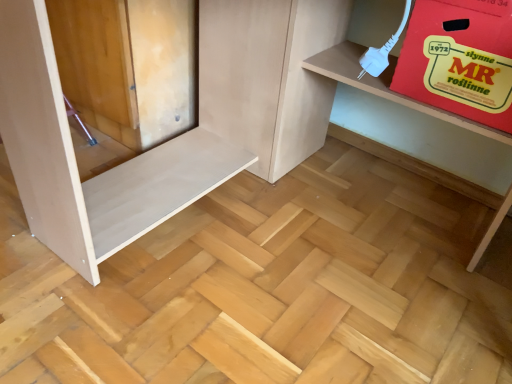
Question: Can you confirm if matte cardboard box at upper right is wider than red cardboard box at upper right?

Choices:
 (A) no
 (B) yes

Answer: (B)

Question: From the image's perspective, is matte cardboard box at upper right beneath red cardboard box at upper right?

Choices:
 (A) no
 (B) yes

Answer: (B)

Question: Does matte cardboard box at upper right have a smaller size compared to red cardboard box at upper right?

Choices:
 (A) yes
 (B) no

Answer: (B)

Question: Is matte cardboard box at upper right bigger than red cardboard box at upper right?

Choices:
 (A) yes
 (B) no

Answer: (A)

Question: Is matte cardboard box at upper right shorter than red cardboard box at upper right?

Choices:
 (A) no
 (B) yes

Answer: (A)

Question: Is matte cardboard box at upper right positioned in front of red cardboard box at upper right?

Choices:
 (A) yes
 (B) no

Answer: (A)

Question: From the image's perspective, would you say red cardboard box at upper right is shown under matte cardboard box at upper right?

Choices:
 (A) no
 (B) yes

Answer: (A)

Question: From the image's perspective, is red cardboard box at upper right over matte cardboard box at upper right?

Choices:
 (A) no
 (B) yes

Answer: (B)

Question: Is matte cardboard box at upper right completely or partially inside red cardboard box at upper right?

Choices:
 (A) no
 (B) yes

Answer: (A)

Question: Does red cardboard box at upper right turn towards matte cardboard box at upper right?

Choices:
 (A) yes
 (B) no

Answer: (A)

Question: Does red cardboard box at upper right appear on the left side of matte cardboard box at upper right?

Choices:
 (A) yes
 (B) no

Answer: (B)

Question: Are red cardboard box at upper right and matte cardboard box at upper right far apart?

Choices:
 (A) yes
 (B) no

Answer: (B)

Question: Considering the positions of red cardboard box at upper right and matte cardboard box at upper right in the image, is red cardboard box at upper right bigger or smaller than matte cardboard box at upper right?

Choices:
 (A) small
 (B) big

Answer: (A)